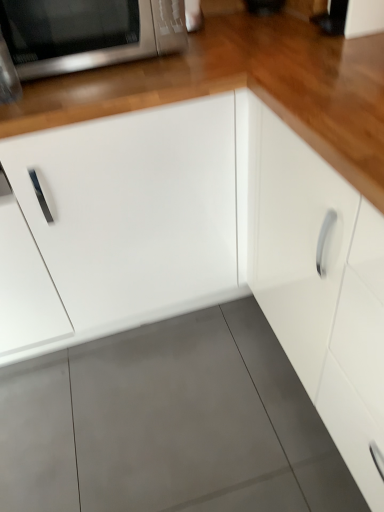
Question: Considering the positions of white matte cabinet at center, which is counted as the 1th cabinetry, starting from the left, and white glossy cabinet at center, positioned as the second cabinetry in left-to-right order, in the image, is white matte cabinet at center, which is counted as the 1th cabinetry, starting from the left, taller or shorter than white glossy cabinet at center, positioned as the second cabinetry in left-to-right order,?

Choices:
 (A) tall
 (B) short

Answer: (B)

Question: Do you think white matte cabinet at center, which is counted as the 1th cabinetry, starting from the left, is within white glossy cabinet at center, positioned as the second cabinetry in left-to-right order, or outside of it?

Choices:
 (A) inside
 (B) outside

Answer: (B)

Question: Estimate the real-world distances between objects in this image. Which object is farther from the satin silver microwave at upper left?

Choices:
 (A) white matte cabinet at center, which is counted as the 1th cabinetry, starting from the left
 (B) white glossy cabinet at center, the 1th cabinetry from the right

Answer: (B)

Question: Which object is positioned closest to the white matte cabinet at center, the second cabinetry viewed from the right?

Choices:
 (A) satin silver microwave at upper left
 (B) white glossy cabinet at center, positioned as the second cabinetry in left-to-right order

Answer: (B)